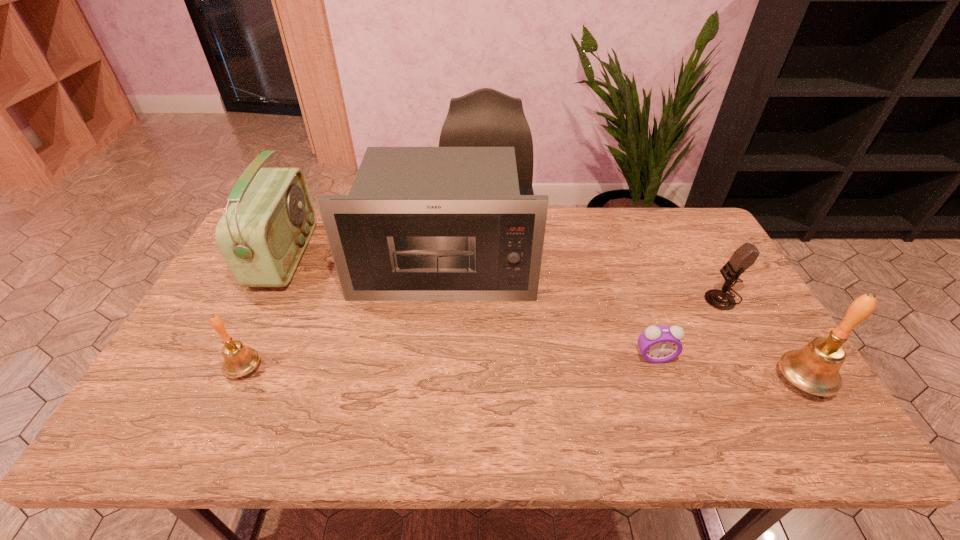
Find the location of a particular element. microphone that is at the right edge is located at coordinates (745, 256).

In order to click on object present at the far left corner in this screenshot , I will do `click(262, 235)`.

Where is `object present at the near left corner`? This screenshot has width=960, height=540. object present at the near left corner is located at coordinates (238, 361).

The image size is (960, 540). Identify the location of object that is at the near right corner. (815, 368).

At what (x,y) coordinates should I click in order to perform the action: click on free space at the far edge of the desktop. Please return your answer as a coordinate pair (x, y). This screenshot has height=540, width=960. Looking at the image, I should click on (570, 215).

Locate an element on the screen. The width and height of the screenshot is (960, 540). free space at the near edge of the desktop is located at coordinates coord(660,384).

Identify the location of free space at the left edge of the desktop. The image size is (960, 540). (260, 288).

Where is `free space at the right edge of the desktop`? The image size is (960, 540). free space at the right edge of the desktop is located at coordinates (750, 364).

Identify the location of free space between the microphone and the shorter bell. (483, 333).

I want to click on free area in between the taller bell and the microphone, so click(762, 339).